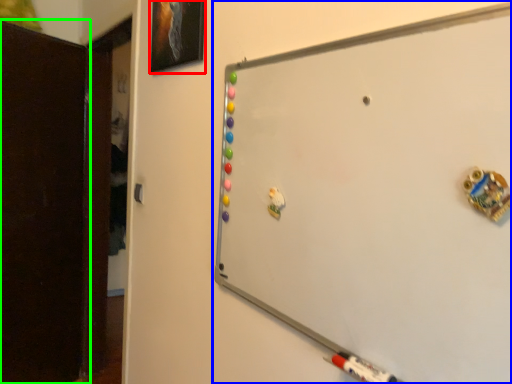
Question: Considering the real-world distances, which object is closest to picture frame (highlighted by a red box)? whiteboard (highlighted by a blue box) or door (highlighted by a green box).

Choices:
 (A) whiteboard
 (B) door

Answer: (A)